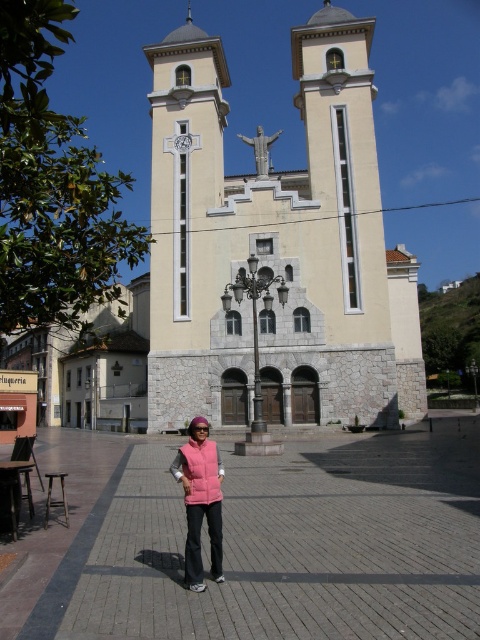
Between beige stone church at center and pink fleece vest at center, which one has more height?

Result: Standing taller between the two is beige stone church at center.

Does point (349, 262) lie behind point (216, 467)?

Yes, it is.

Locate an element on the screen. Image resolution: width=480 pixels, height=640 pixels. beige stone church at center is located at coordinates (276, 244).

Who is taller, beige stone church at center or pink quilted vest at center?

beige stone church at center

What do you see at coordinates (276, 244) in the screenshot? The image size is (480, 640). I see `beige stone church at center` at bounding box center [276, 244].

This screenshot has height=640, width=480. Describe the element at coordinates (276, 244) in the screenshot. I see `beige stone church at center` at that location.

At what (x,y) coordinates should I click in order to perform the action: click on beige stone church at center. Please return your answer as a coordinate pair (x, y). Looking at the image, I should click on (276, 244).

Is point (173, 465) positioned before point (189, 444)?

Yes, it is.

Find the location of `pink quilted vest at center`. pink quilted vest at center is located at coordinates (201, 500).

Where is `pink quilted vest at center`? pink quilted vest at center is located at coordinates [x=201, y=500].